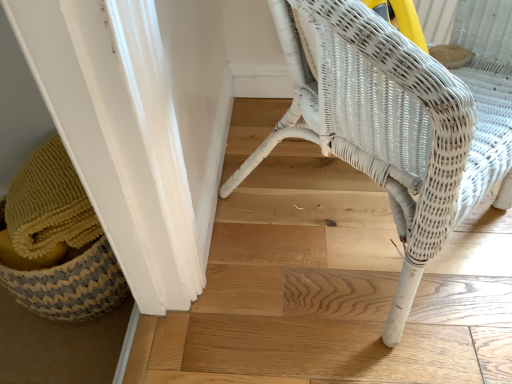
The image size is (512, 384). Describe the element at coordinates (403, 119) in the screenshot. I see `white wicker chair at center` at that location.

Locate an element on the screen. This screenshot has height=384, width=512. white wicker chair at center is located at coordinates (403, 119).

Where is `white wicker chair at center`? white wicker chair at center is located at coordinates (403, 119).